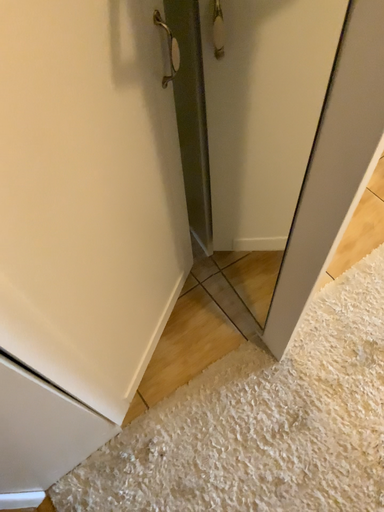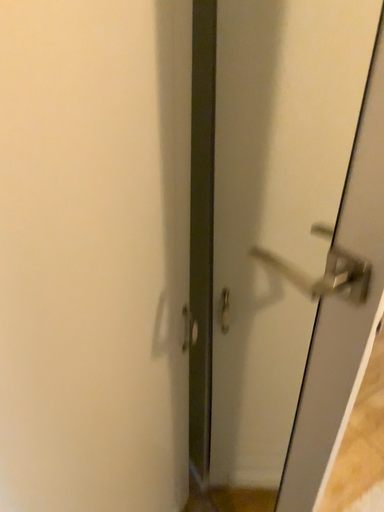
Question: Which way did the camera rotate in the video?

Choices:
 (A) rotated upward
 (B) rotated downward

Answer: (A)